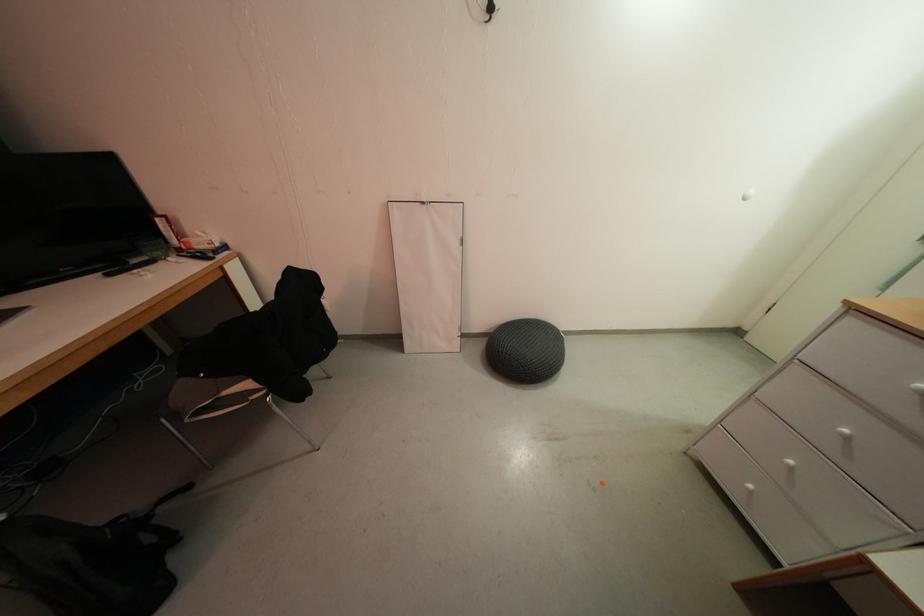
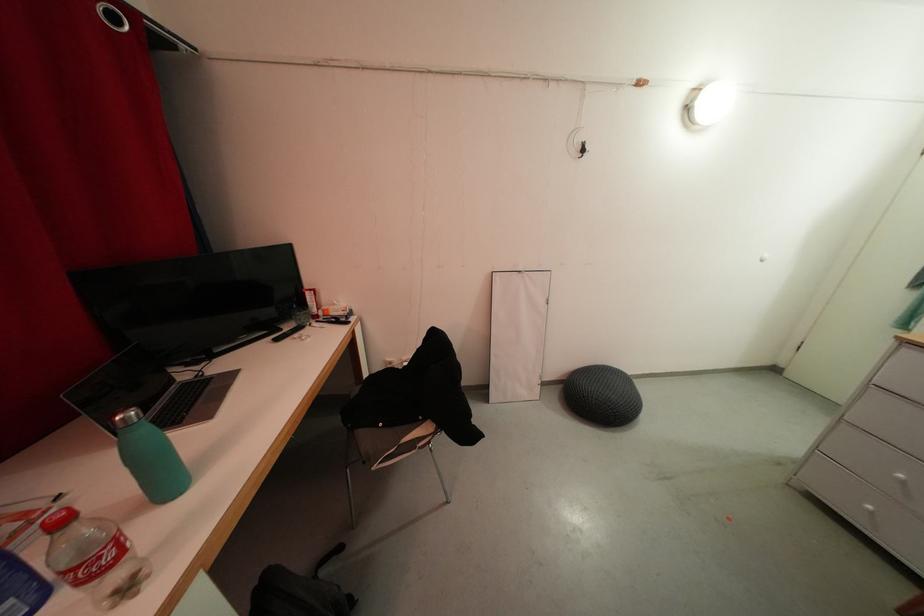
In the second image, find the point that corresponds to point (140, 265) in the first image.

(293, 331)